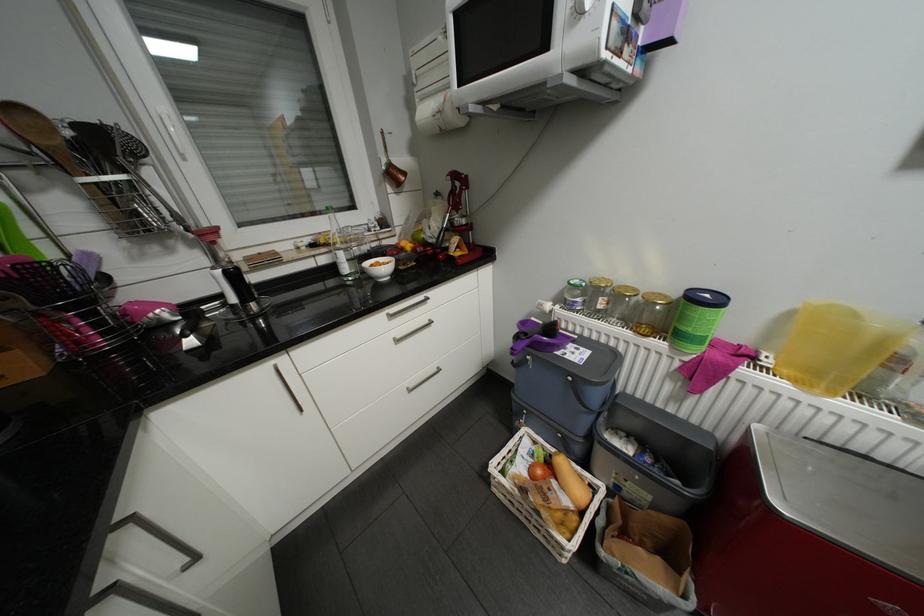
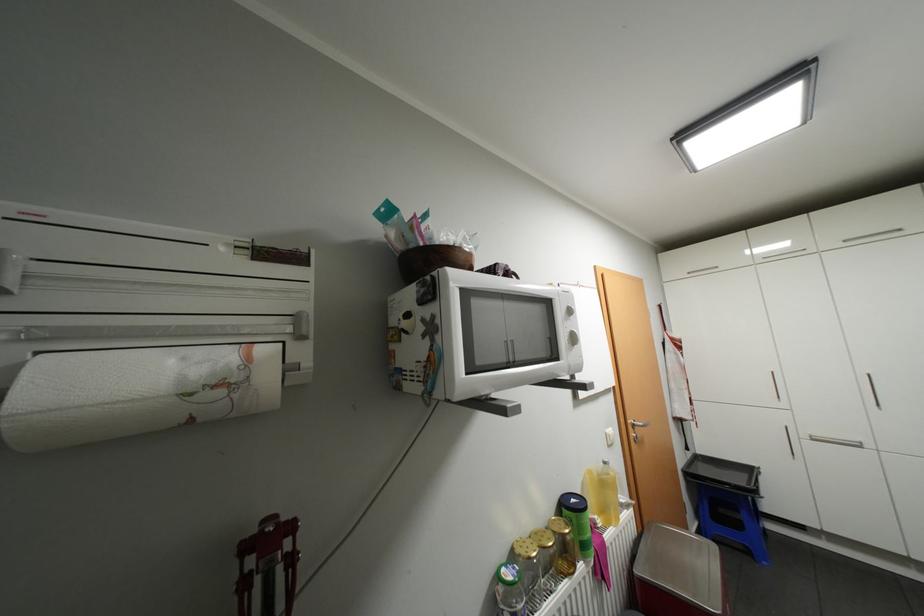
In the second image, find the point that corresponds to the point at 579,281 in the first image.

(518, 576)